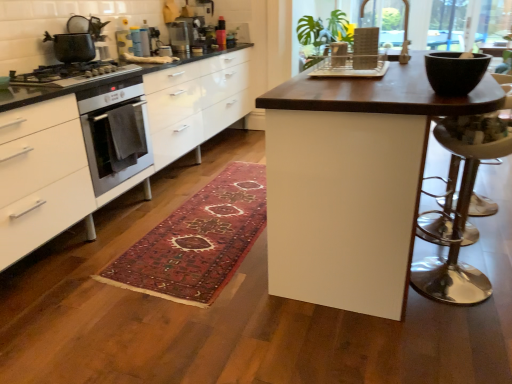
The height and width of the screenshot is (384, 512). I want to click on vacant region to the left of dark wood table at center, so point(189,248).